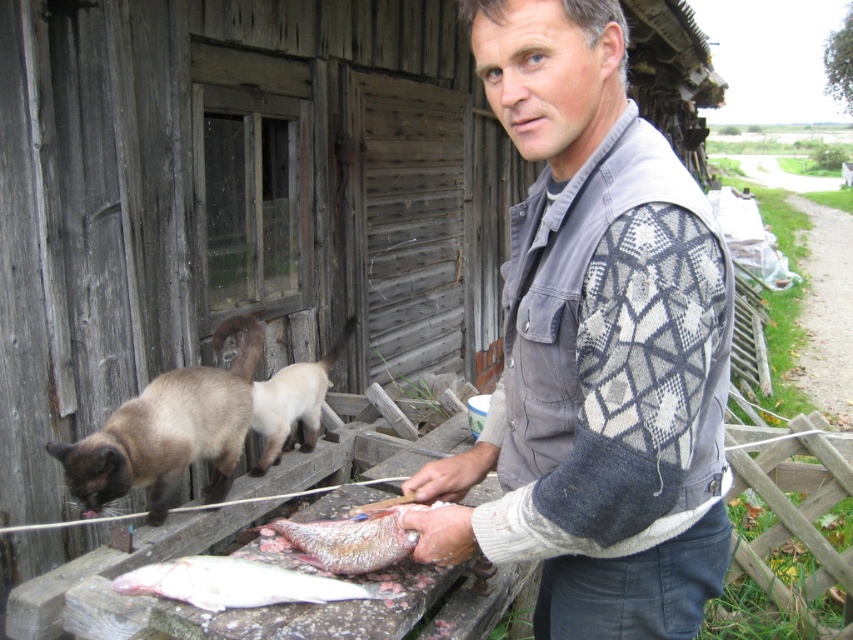
Question: Which object is positioned farthest from the speckled skin fish at lower center?

Choices:
 (A) white fleshed fish at lower center
 (B) siamese fur cat at left
 (C) gray sweater at center
 (D) brown fur cat at center

Answer: (D)

Question: Considering the relative positions of siamese fur cat at left and white fleshed fish at lower center in the image provided, where is siamese fur cat at left located with respect to white fleshed fish at lower center?

Choices:
 (A) left
 (B) right

Answer: (A)

Question: Among these objects, which one is farthest from the camera?

Choices:
 (A) white fleshed fish at lower center
 (B) brown fur cat at center

Answer: (B)

Question: Can you confirm if siamese fur cat at left is positioned below speckled skin fish at lower center?

Choices:
 (A) yes
 (B) no

Answer: (B)

Question: Estimate the real-world distances between objects in this image. Which object is closer to the white fleshed fish at lower center?

Choices:
 (A) speckled skin fish at lower center
 (B) siamese fur cat at left
 (C) gray sweater at center

Answer: (A)

Question: Considering the relative positions of siamese fur cat at left and speckled skin fish at lower center in the image provided, where is siamese fur cat at left located with respect to speckled skin fish at lower center?

Choices:
 (A) above
 (B) below

Answer: (A)